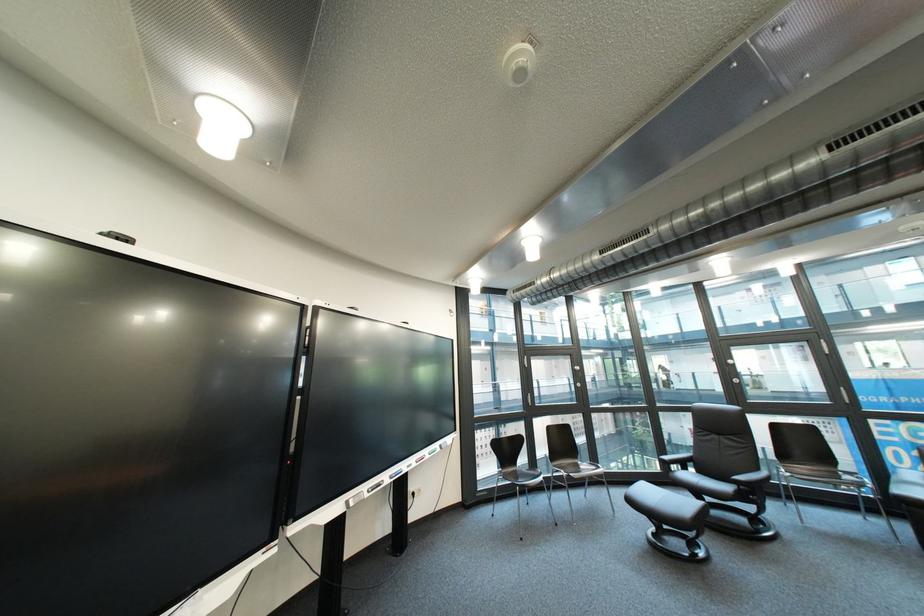
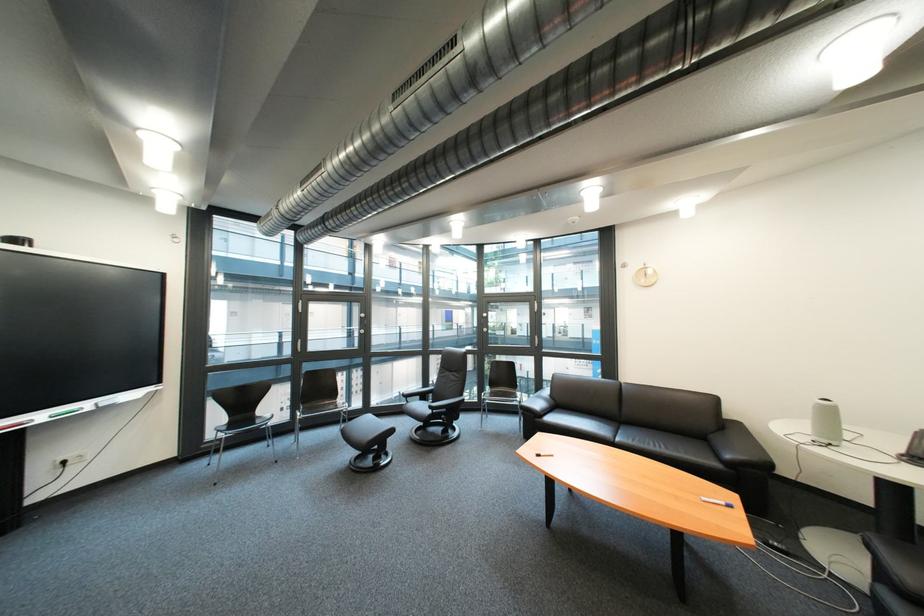
Where in the second image is the point corresponding to (450,447) from the first image?

(101, 406)